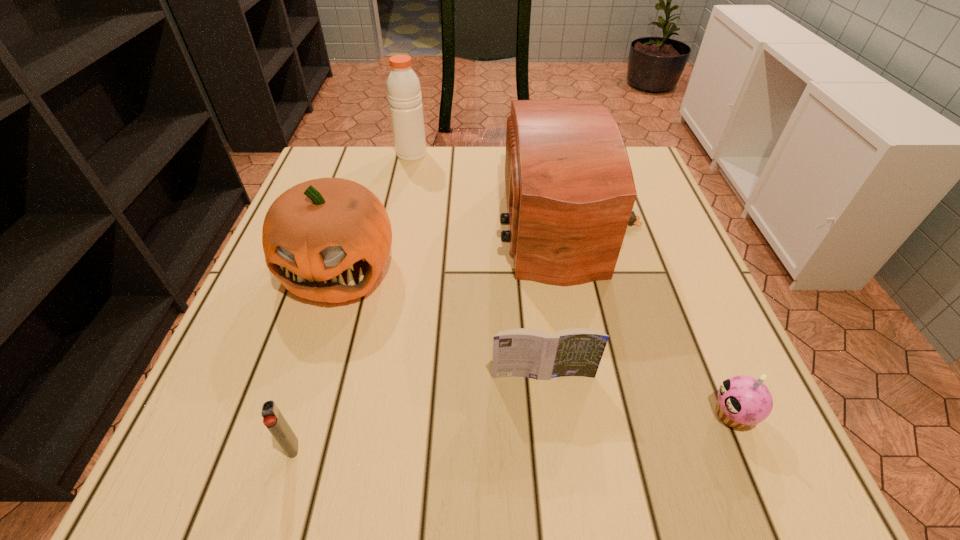
Where is `blank space located 0.140m on the face of the third tallest object`? Image resolution: width=960 pixels, height=540 pixels. blank space located 0.140m on the face of the third tallest object is located at coordinates (305, 377).

This screenshot has width=960, height=540. Find the location of `free spot located 0.120m on the face of the second nearest object`. free spot located 0.120m on the face of the second nearest object is located at coordinates (634, 414).

Where is `vacant space located on the face of the second nearest object`? The width and height of the screenshot is (960, 540). vacant space located on the face of the second nearest object is located at coordinates (511, 414).

Find the location of a particular element. Image resolution: width=960 pixels, height=540 pixels. free space located 0.080m on the face of the second nearest object is located at coordinates (659, 414).

Identify the location of vacant area situated 0.260m on the right of the nearest object. (476, 448).

Identify the location of shaker that is at the far edge. (404, 94).

I want to click on radio receiver at the far edge, so click(570, 191).

This screenshot has width=960, height=540. Identify the location of cupcake that is at the near edge. (743, 401).

Locate an element on the screen. igniter present at the near edge is located at coordinates (273, 419).

Find the location of `pumpkin located at the left edge`. pumpkin located at the left edge is located at coordinates (327, 240).